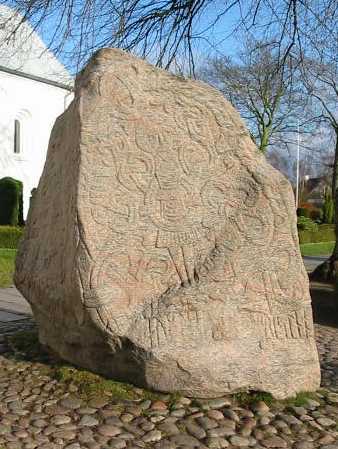
Locate an element on the screen. Image resolution: width=338 pixels, height=449 pixels. chimney is located at coordinates (306, 178).